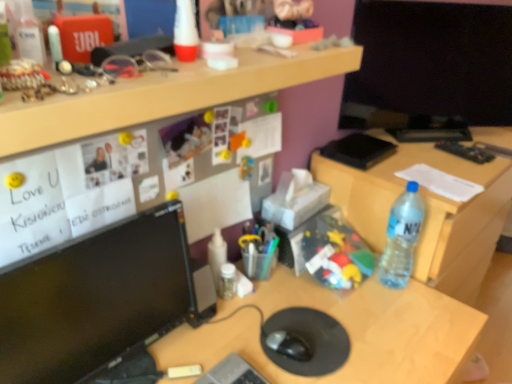
The height and width of the screenshot is (384, 512). I want to click on free space between black rubber mousepad at center and translucent plastic bottle at center, which is the 1th bottle from left to right, so click(251, 306).